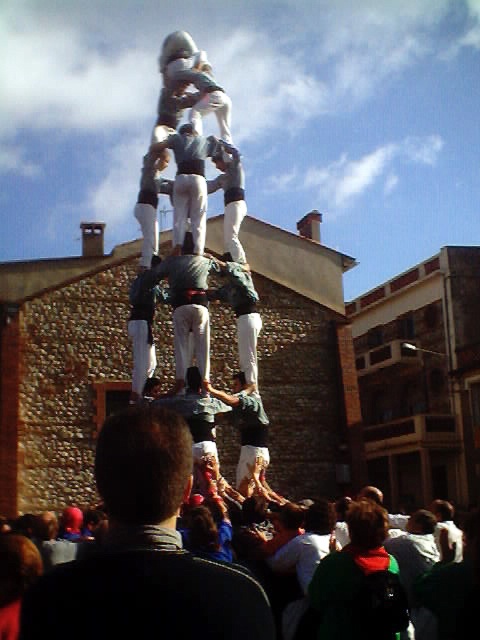
What do you see at coordinates (144, 552) in the screenshot?
I see `dark brown hair at center` at bounding box center [144, 552].

Can you confirm if dark brown hair at center is positioned to the left of dark gray fabric shirt at center?

Indeed, dark brown hair at center is positioned on the left side of dark gray fabric shirt at center.

You are a GUI agent. You are given a task and a screenshot of the screen. Output one action in this format:
    pyautogui.click(x=<x>, y=<y>)
    Task: Click on the dark brown hair at center
    Image resolution: width=480 pixels, height=640 pixels.
    Given the screenshot: What is the action you would take?
    pyautogui.click(x=144, y=552)

Locate an element on the screen. This screenshot has height=640, width=480. dark brown hair at center is located at coordinates (144, 552).

Image resolution: width=480 pixels, height=640 pixels. What are the coordinates of `dark brown hair at center` in the screenshot? It's located at (144, 552).

Is dark brown hair at center in front of white cotton shirt at center?

That is True.

The image size is (480, 640). Find the location of `dark brown hair at center`. dark brown hair at center is located at coordinates (144, 552).

Between point (192, 308) and point (242, 419), which one is positioned in front?

Positioned in front is point (192, 308).

Which is above, dark gray fabric shirt at center or white cotton shirt at center?

dark gray fabric shirt at center is above.

Between point (190, 326) and point (216, 396), which one is positioned in front?

Positioned in front is point (216, 396).

Where is `dark gray fabric shirt at center`? This screenshot has width=480, height=640. dark gray fabric shirt at center is located at coordinates (188, 307).